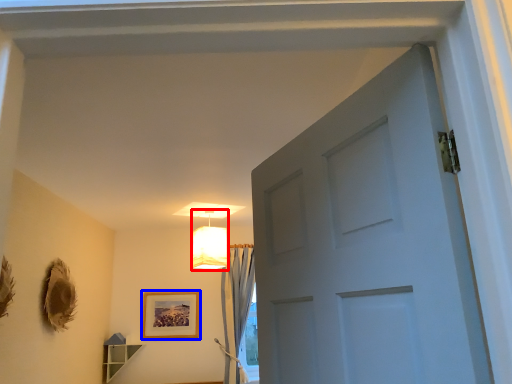
Question: Among these objects, which one is nearest to the camera, lamp (highlighted by a red box) or picture frame (highlighted by a blue box)?

Choices:
 (A) lamp
 (B) picture frame

Answer: (A)